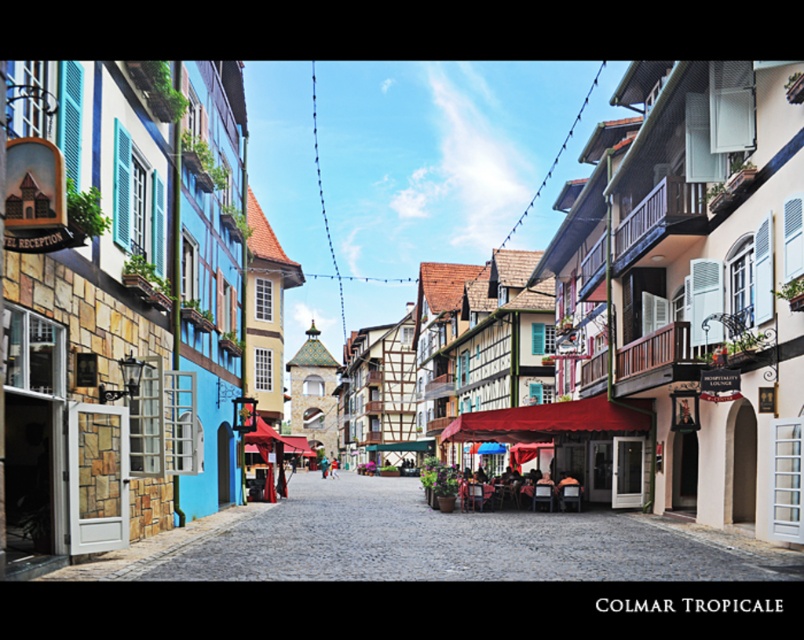
You are standing at the EL RECEPTION building on the left side of the street. Looking towards the center of the street, you see a point marked at coordinates (457, 541). What is this point likely representing in the scene?

The point at (457, 541) represents the smooth stone street at center, indicating its central location in the scene.

You are a tourist standing on the red fabric canopy at center and want to walk to the smooth stone street at center. Is the ground you are currently standing on higher or lower than the ground you want to walk to?

The smooth stone street at center is taller than the red fabric canopy at center, so the ground you are currently standing on is lower than the ground you want to walk to.